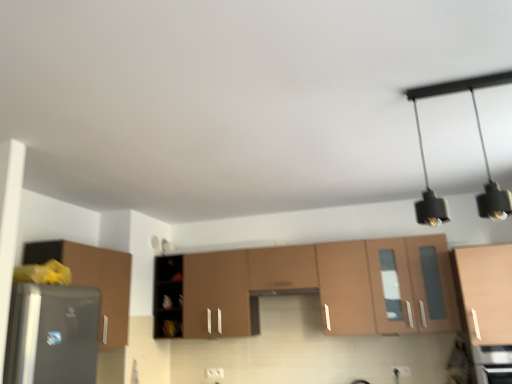
Question: Can you confirm if satin black oven at lower right is shorter than black matte light fixture at upper right?

Choices:
 (A) yes
 (B) no

Answer: (A)

Question: Is satin black oven at lower right surrounding black matte light fixture at upper right?

Choices:
 (A) no
 (B) yes

Answer: (A)

Question: Is satin black oven at lower right bigger than black matte light fixture at upper right?

Choices:
 (A) no
 (B) yes

Answer: (B)

Question: From a real-world perspective, is satin black oven at lower right under black matte light fixture at upper right?

Choices:
 (A) no
 (B) yes

Answer: (B)

Question: Considering the relative positions of satin black oven at lower right and black matte light fixture at upper right in the image provided, is satin black oven at lower right to the right of black matte light fixture at upper right from the viewer's perspective?

Choices:
 (A) no
 (B) yes

Answer: (B)

Question: Based on their positions, is satin black oven at lower right located to the left or right of matte wood cabinet at right, which ranks as the first cabinetry in right-to-left order?

Choices:
 (A) left
 (B) right

Answer: (A)

Question: From a real-world perspective, is satin black oven at lower right positioned above or below matte wood cabinet at right, which ranks as the third cabinetry in left-to-right order?

Choices:
 (A) below
 (B) above

Answer: (A)

Question: Considering the positions of satin black oven at lower right and matte wood cabinet at right, which ranks as the third cabinetry in left-to-right order, in the image, is satin black oven at lower right taller or shorter than matte wood cabinet at right, which ranks as the third cabinetry in left-to-right order,?

Choices:
 (A) tall
 (B) short

Answer: (B)

Question: Is point coord(508,375) closer or farther from the camera than point coord(480,283)?

Choices:
 (A) closer
 (B) farther

Answer: (A)

Question: Choose the correct answer: Is black matte light fixture at upper right inside matte brown cabinet at left, arranged as the 3th cabinetry when viewed from the right, or outside it?

Choices:
 (A) outside
 (B) inside

Answer: (A)

Question: Is black matte light fixture at upper right in front of or behind matte brown cabinet at left, arranged as the 3th cabinetry when viewed from the right, in the image?

Choices:
 (A) front
 (B) behind

Answer: (A)

Question: From a real-world perspective, is black matte light fixture at upper right positioned above or below matte brown cabinet at left, acting as the first cabinetry starting from the left?

Choices:
 (A) below
 (B) above

Answer: (B)

Question: Considering the positions of black matte light fixture at upper right and matte brown cabinet at left, acting as the first cabinetry starting from the left, in the image, is black matte light fixture at upper right taller or shorter than matte brown cabinet at left, acting as the first cabinetry starting from the left,?

Choices:
 (A) tall
 (B) short

Answer: (B)

Question: Does point (501, 273) appear closer or farther from the camera than point (249, 321)?

Choices:
 (A) closer
 (B) farther

Answer: (A)

Question: From a real-world perspective, is matte wood cabinet at right, which ranks as the third cabinetry in left-to-right order, physically located above or below matte brown cabinet at center, arranged as the 2th cabinetry when viewed from the right?

Choices:
 (A) above
 (B) below

Answer: (B)